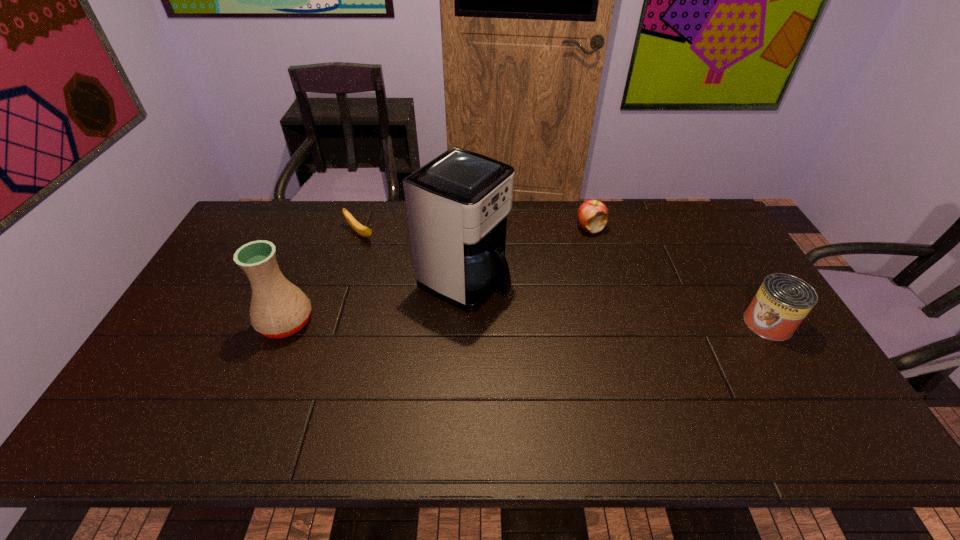
The image size is (960, 540). Find the location of `banana that is at the far edge`. banana that is at the far edge is located at coordinates (363, 231).

At what (x,y) coordinates should I click in order to perform the action: click on object situated at the right edge. Please return your answer as a coordinate pair (x, y). Image resolution: width=960 pixels, height=540 pixels. Looking at the image, I should click on (782, 302).

Where is `vacant area at the far edge`? The image size is (960, 540). vacant area at the far edge is located at coordinates (526, 206).

Find the location of `vacant region at the near edge`. vacant region at the near edge is located at coordinates (389, 379).

This screenshot has height=540, width=960. What are the coordinates of `free space at the left edge of the desktop` in the screenshot? It's located at (149, 367).

Where is `vacant space at the right edge`? This screenshot has height=540, width=960. vacant space at the right edge is located at coordinates (739, 280).

In the image, there is a desktop. Identify the location of vacant space at the far right corner. The width and height of the screenshot is (960, 540). (716, 241).

The height and width of the screenshot is (540, 960). I want to click on blank region between the fourth shortest object and the third object from left to right, so click(x=374, y=301).

Locate an element on the screen. This screenshot has height=540, width=960. free space that is in between the third tallest object and the fourth tallest object is located at coordinates (679, 276).

I want to click on vacant space that's between the fourth tallest object and the can, so click(679, 276).